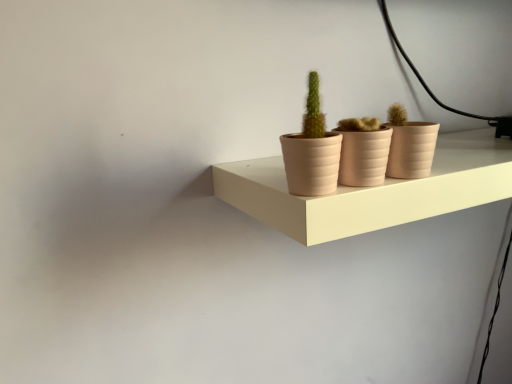
Question: From a real-world perspective, is matte beige shelf at center on top of matte clay flowerpot at center, which ranks as the 2th flowerpot in right-to-left order?

Choices:
 (A) no
 (B) yes

Answer: (A)

Question: Is matte beige shelf at center next to matte clay flowerpot at center, which ranks as the first flowerpot in left-to-right order, and touching it?

Choices:
 (A) yes
 (B) no

Answer: (B)

Question: From the image's perspective, is matte beige shelf at center on top of matte clay flowerpot at center, which ranks as the first flowerpot in left-to-right order?

Choices:
 (A) yes
 (B) no

Answer: (B)

Question: Can you confirm if matte beige shelf at center is smaller than matte clay flowerpot at center, which ranks as the 2th flowerpot in right-to-left order?

Choices:
 (A) yes
 (B) no

Answer: (B)

Question: Is matte beige shelf at center looking in the opposite direction of matte clay flowerpot at center, which ranks as the 2th flowerpot in right-to-left order?

Choices:
 (A) no
 (B) yes

Answer: (A)

Question: Is point [x=229, y=168] positioned closer to the camera than point [x=308, y=79]?

Choices:
 (A) farther
 (B) closer

Answer: (B)

Question: Considering their positions, is matte beige shelf at center located in front of or behind matte pink pot at center?

Choices:
 (A) front
 (B) behind

Answer: (B)

Question: Is matte beige shelf at center situated inside matte pink pot at center or outside?

Choices:
 (A) outside
 (B) inside

Answer: (A)

Question: Considering the positions of matte beige shelf at center and matte pink pot at center in the image, is matte beige shelf at center bigger or smaller than matte pink pot at center?

Choices:
 (A) big
 (B) small

Answer: (A)

Question: In terms of size, does matte beige shelf at center appear bigger or smaller than matte pink flowerpot at center, which ranks as the second flowerpot in left-to-right order?

Choices:
 (A) big
 (B) small

Answer: (A)

Question: From a real-world perspective, is matte beige shelf at center positioned above or below matte pink flowerpot at center, which ranks as the second flowerpot in left-to-right order?

Choices:
 (A) below
 (B) above

Answer: (A)

Question: Would you say matte beige shelf at center is inside or outside matte pink flowerpot at center, which ranks as the second flowerpot in left-to-right order?

Choices:
 (A) inside
 (B) outside

Answer: (B)

Question: From the image's perspective, is matte beige shelf at center above or below matte pink flowerpot at center, which ranks as the second flowerpot in left-to-right order?

Choices:
 (A) below
 (B) above

Answer: (A)

Question: From the image's perspective, is matte clay flowerpot at center, which ranks as the first flowerpot in left-to-right order, located above or below matte beige shelf at center?

Choices:
 (A) below
 (B) above

Answer: (B)

Question: Would you say matte clay flowerpot at center, which ranks as the 2th flowerpot in right-to-left order, is to the left or to the right of matte beige shelf at center in the picture?

Choices:
 (A) right
 (B) left

Answer: (B)